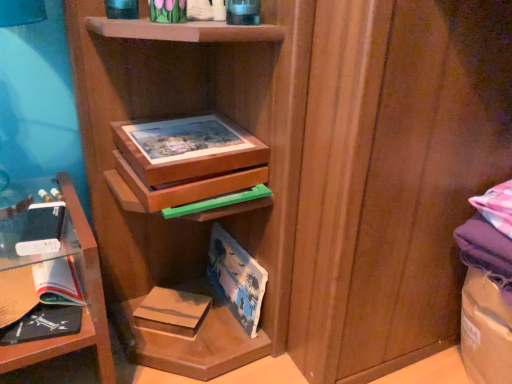
Question: Is matte paper paperback book at center, the first paperback book in the right-to-left sequence, at the left side of clear glass shelf at left?

Choices:
 (A) yes
 (B) no

Answer: (B)

Question: Is clear glass shelf at left surrounded by matte paper paperback book at center, the first paperback book in the right-to-left sequence?

Choices:
 (A) no
 (B) yes

Answer: (A)

Question: Is matte paper paperback book at center, the first paperback book in the right-to-left sequence, further to camera compared to clear glass shelf at left?

Choices:
 (A) yes
 (B) no

Answer: (A)

Question: Can you confirm if matte paper paperback book at center, arranged as the third paperback book when viewed from the left, is taller than clear glass shelf at left?

Choices:
 (A) no
 (B) yes

Answer: (A)

Question: Does matte paper paperback book at center, the first paperback book in the right-to-left sequence, have a greater width compared to clear glass shelf at left?

Choices:
 (A) yes
 (B) no

Answer: (B)

Question: Based on their sizes in the image, would you say matte paper paperback book at center, the first paperback book in the right-to-left sequence, is bigger or smaller than brown cardboard book at lower center, the 2th paperback book when ordered from right to left?

Choices:
 (A) big
 (B) small

Answer: (A)

Question: Is matte paper paperback book at center, arranged as the third paperback book when viewed from the left, spatially inside brown cardboard book at lower center, the 2th paperback book when ordered from right to left, or outside of it?

Choices:
 (A) inside
 (B) outside

Answer: (B)

Question: Considering the positions of matte paper paperback book at center, arranged as the third paperback book when viewed from the left, and brown cardboard book at lower center, the second paperback book from the left, in the image, is matte paper paperback book at center, arranged as the third paperback book when viewed from the left, taller or shorter than brown cardboard book at lower center, the second paperback book from the left,?

Choices:
 (A) short
 (B) tall

Answer: (B)

Question: Considering the positions of matte paper paperback book at center, arranged as the third paperback book when viewed from the left, and brown cardboard book at lower center, the 2th paperback book when ordered from right to left, in the image, is matte paper paperback book at center, arranged as the third paperback book when viewed from the left, wider or thinner than brown cardboard book at lower center, the 2th paperback book when ordered from right to left,?

Choices:
 (A) thin
 (B) wide

Answer: (A)

Question: Does point (15, 292) appear closer or farther from the camera than point (168, 329)?

Choices:
 (A) farther
 (B) closer

Answer: (B)

Question: From their relative heights in the image, would you say clear glass shelf at left is taller or shorter than brown cardboard book at lower center, the second paperback book from the left?

Choices:
 (A) short
 (B) tall

Answer: (B)

Question: In the image, is clear glass shelf at left positioned in front of or behind brown cardboard book at lower center, the 2th paperback book when ordered from right to left?

Choices:
 (A) behind
 (B) front

Answer: (B)

Question: From the image's perspective, is clear glass shelf at left positioned above or below brown cardboard book at lower center, the second paperback book from the left?

Choices:
 (A) below
 (B) above

Answer: (B)

Question: Is black matte book at lower left wider or thinner than brown cardboard book at lower center, the 2th paperback book when ordered from right to left?

Choices:
 (A) thin
 (B) wide

Answer: (B)

Question: From the image's perspective, relative to brown cardboard book at lower center, the 2th paperback book when ordered from right to left, is black matte book at lower left above or below?

Choices:
 (A) above
 (B) below

Answer: (A)